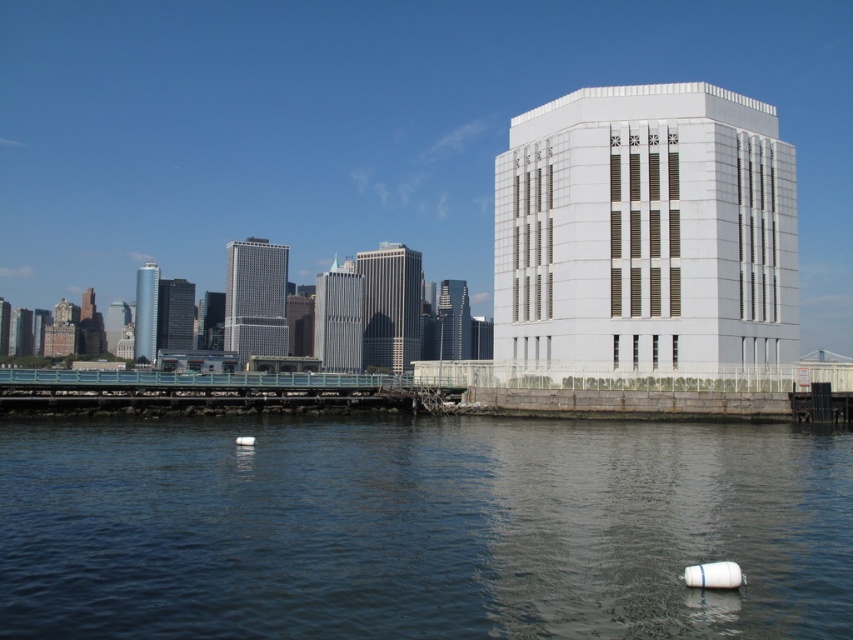
You are standing at the waterfront and looking at the modern white building. There are two points marked on the building. One is at coordinate point [573,349] and the other at point [155,352]. Which point is closer to your eyes?

Point [573,349] is closer to the camera than point [155,352].

You are standing on the waterfront and see the white smooth building at right and the silver glass skyscraper at center. Which structure is closer to you?

The white smooth building at right is closer to you because it is positioned in front of the silver glass skyscraper at center.

You are an architect evaluating the skyline of a city. You observe two skyscrapers in the background of the waterfront scene. Which one is taller between the gray glass skyscraper at center and the silver glass skyscraper at center?

The gray glass skyscraper at center is taller than the silver glass skyscraper at center.